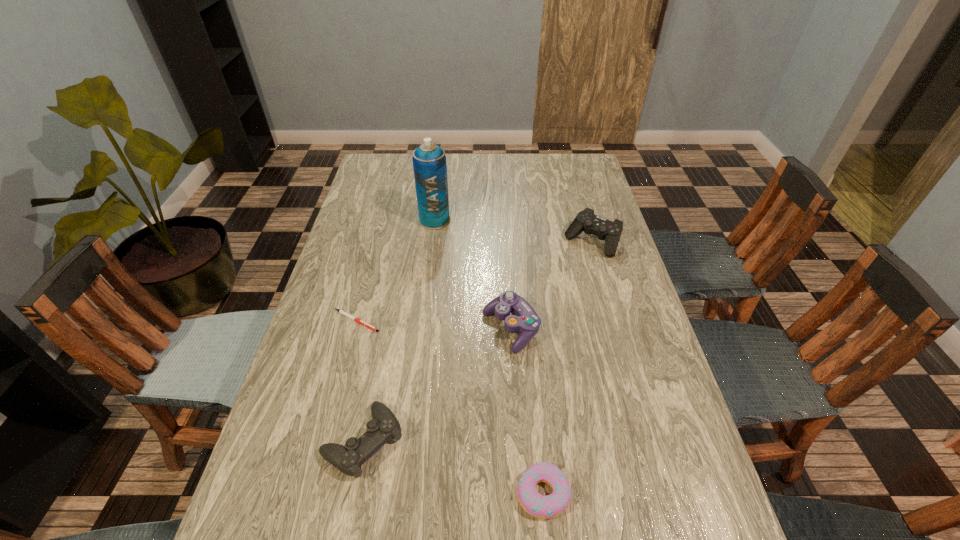
In the image, there is a desktop. At what (x,y) coordinates should I click in order to perform the action: click on vacant space at the far right corner. Please return your answer as a coordinate pair (x, y). Image resolution: width=960 pixels, height=540 pixels. Looking at the image, I should click on (558, 172).

Locate an element on the screen. The height and width of the screenshot is (540, 960). vacant space in between the second control from right to left and the pen is located at coordinates (434, 325).

In order to click on free spot between the shortest object and the farthest control in this screenshot , I will do `click(474, 281)`.

You are a GUI agent. You are given a task and a screenshot of the screen. Output one action in this format:
    pyautogui.click(x=<x>, y=<y>)
    Task: Click on the vacant region between the shortest object and the second nearest control
    The height and width of the screenshot is (540, 960).
    Given the screenshot: What is the action you would take?
    pyautogui.click(x=434, y=325)

This screenshot has width=960, height=540. In order to click on unoccupied area between the second shortest object and the shortest object in this screenshot , I will do `click(449, 407)`.

Find the location of a particular element. This screenshot has height=540, width=960. free space between the second nearest control and the farthest control is located at coordinates (552, 286).

Locate an element on the screen. This screenshot has width=960, height=540. blank region between the second nearest control and the farthest control is located at coordinates [552, 286].

This screenshot has width=960, height=540. Find the location of `free space between the doughnut and the shortest object`. free space between the doughnut and the shortest object is located at coordinates (x=449, y=407).

The width and height of the screenshot is (960, 540). Find the location of `vacant area between the aerosol can and the pen`. vacant area between the aerosol can and the pen is located at coordinates coord(396,271).

Where is `free spot between the farthest control and the pen`? This screenshot has height=540, width=960. free spot between the farthest control and the pen is located at coordinates (474, 281).